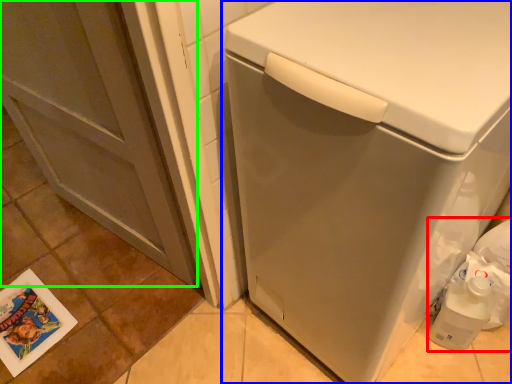
Question: Which object is positioned closest to garbage (highlighted by a red box)? Select from washing machine (highlighted by a blue box) and screen door (highlighted by a green box).

Choices:
 (A) washing machine
 (B) screen door

Answer: (A)